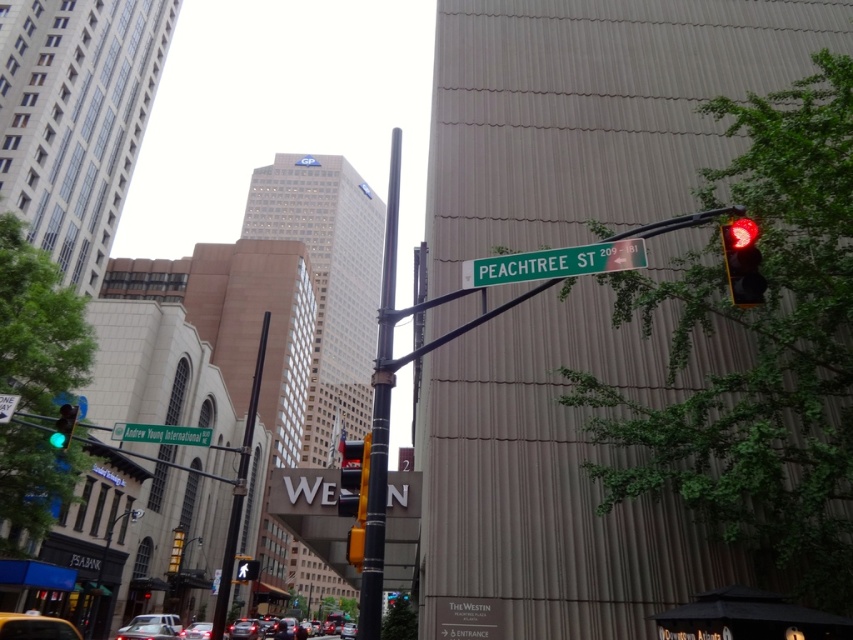
Does matte silver sedan at center lie behind red glass pedestrian signal at center?

Yes.

How distant is matte silver sedan at center from red glass pedestrian signal at center?

The distance of matte silver sedan at center from red glass pedestrian signal at center is 5.22 meters.

Identify the location of matte silver sedan at center. The width and height of the screenshot is (853, 640). (244, 628).

How far apart are metallic silver sedan at lower center and matte silver sedan at lower left?

metallic silver sedan at lower center and matte silver sedan at lower left are 4.69 meters apart.

Does metallic silver sedan at lower center have a lesser height compared to matte silver sedan at lower left?

Incorrect, metallic silver sedan at lower center's height does not fall short of matte silver sedan at lower left's.

Identify the location of metallic silver sedan at lower center. The height and width of the screenshot is (640, 853). (138, 625).

Who is more forward, (4, 348) or (408, 621)?

Point (4, 348) is more forward.

Can you confirm if green leafy tree at left is wider than green matte tree at lower center?

Indeed, green leafy tree at left has a greater width compared to green matte tree at lower center.

Between point (51, 282) and point (392, 625), which one is positioned in front?

Positioned in front is point (392, 625).

Locate an element on the screen. The height and width of the screenshot is (640, 853). green leafy tree at left is located at coordinates coord(38,324).